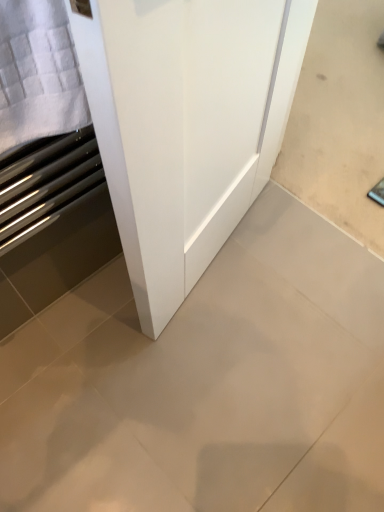
The height and width of the screenshot is (512, 384). What do you see at coordinates (38, 73) in the screenshot?
I see `white textured towel at left` at bounding box center [38, 73].

The width and height of the screenshot is (384, 512). Identify the location of white textured towel at left. (38, 73).

Identify the location of matte gray tile at center. The height and width of the screenshot is (512, 384). (207, 383).

What do you see at coordinates (207, 383) in the screenshot? This screenshot has width=384, height=512. I see `matte gray tile at center` at bounding box center [207, 383].

Locate an element on the screen. white textured towel at left is located at coordinates (38, 73).

Considering the relative positions of white textured towel at left and matte gray tile at center in the image provided, is white textured towel at left to the right of matte gray tile at center from the viewer's perspective?

Incorrect, white textured towel at left is not on the right side of matte gray tile at center.

Considering the relative positions of white textured towel at left and matte gray tile at center in the image provided, is white textured towel at left in front of matte gray tile at center?

That is True.

Does point (37, 102) appear closer or farther from the camera than point (138, 375)?

Point (37, 102) is positioned closer to the camera compared to point (138, 375).

From the image's perspective, is white textured towel at left above matte gray tile at center?

Yes, from the image's perspective, white textured towel at left is over matte gray tile at center.

From a real-world perspective, is white textured towel at left under matte gray tile at center?

No.

Which of these two, white textured towel at left or matte gray tile at center, is thinner?

white textured towel at left is thinner.

Considering the relative sizes of white textured towel at left and matte gray tile at center in the image provided, is white textured towel at left shorter than matte gray tile at center?

No, white textured towel at left is not shorter than matte gray tile at center.

Can you confirm if white textured towel at left is bigger than matte gray tile at center?

No.

Would you say white textured towel at left contains matte gray tile at center?

Actually, matte gray tile at center is outside white textured towel at left.

Is white textured towel at left placed right next to matte gray tile at center?

There is a gap between white textured towel at left and matte gray tile at center.

Is white textured towel at left aimed at matte gray tile at center?

No, white textured towel at left is not facing towards matte gray tile at center.

Can you tell me how much white textured towel at left and matte gray tile at center differ in facing direction?

The angular difference between white textured towel at left and matte gray tile at center is 89.1 degrees.

How far apart are white textured towel at left and matte gray tile at center?

white textured towel at left and matte gray tile at center are 29.52 inches apart.

This screenshot has width=384, height=512. Find the location of `ceramic tile that appears below the white textured towel at left (from a real-world perspective)`. ceramic tile that appears below the white textured towel at left (from a real-world perspective) is located at coordinates (207, 383).

In the scene shown: Is matte gray tile at center to the left of white textured towel at left from the viewer's perspective?

In fact, matte gray tile at center is to the right of white textured towel at left.

Which object is closer to the camera taking this photo, matte gray tile at center or white textured towel at left?

Positioned in front is white textured towel at left.

Which is behind, point (107, 375) or point (56, 108)?

The point (107, 375) is more distant.

From the image's perspective, between matte gray tile at center and white textured towel at left, which one is located above?

From the image's view, white textured towel at left is above.

From a real-world perspective, is matte gray tile at center under white textured towel at left?

Yes, from a real-world perspective, matte gray tile at center is under white textured towel at left.

Which object is thinner, matte gray tile at center or white textured towel at left?

With smaller width is white textured towel at left.

Which of these two, matte gray tile at center or white textured towel at left, stands taller?

Standing taller between the two is white textured towel at left.

Which of these two, matte gray tile at center or white textured towel at left, is bigger?

With larger size is matte gray tile at center.

Does matte gray tile at center contain white textured towel at left?

No.

Consider the image. Is matte gray tile at center next to white textured towel at left and touching it?

No, matte gray tile at center is not in contact with white textured towel at left.

Is matte gray tile at center turned away from white textured towel at left?

That's not correct — matte gray tile at center is not looking away from white textured towel at left.

From the picture: What's the angular difference between matte gray tile at center and white textured towel at left's facing directions?

matte gray tile at center and white textured towel at left are facing 89.1 degrees away from each other.

At what (x,y) coordinates should I click in order to perform the action: click on cloth above the matte gray tile at center (from a real-world perspective). Please return your answer as a coordinate pair (x, y). This screenshot has height=512, width=384. Looking at the image, I should click on (38, 73).

This screenshot has height=512, width=384. Identify the location of cloth in front of the matte gray tile at center. (38, 73).

In the image, there is a white textured towel at left. Where is `ceramic tile below it (from a real-world perspective)`? ceramic tile below it (from a real-world perspective) is located at coordinates (207, 383).